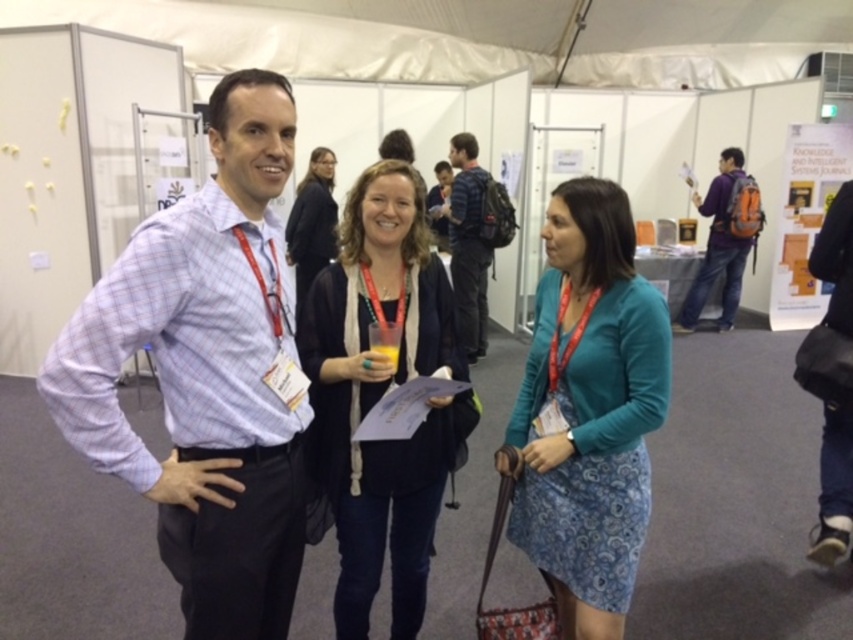
Is point (196, 483) closer to camera compared to point (810, 264)?

Yes, it is.

Can you confirm if plaid shirt at center is positioned to the left of black leather bag at lower right?

Correct, you'll find plaid shirt at center to the left of black leather bag at lower right.

The image size is (853, 640). Find the location of `plaid shirt at center`. plaid shirt at center is located at coordinates (207, 374).

Is blue plaid shirt at center closer to camera compared to matte black jacket at center?

No.

Between point (482, 168) and point (286, 236), which one is positioned behind?

Point (482, 168)

Where is `blue plaid shirt at center`? blue plaid shirt at center is located at coordinates coord(468,243).

Which is below, matte black cardigan at center or blue plaid shirt at center?

Positioned lower is matte black cardigan at center.

Does matte black cardigan at center appear over blue plaid shirt at center?

No, matte black cardigan at center is not above blue plaid shirt at center.

Locate an element on the screen. This screenshot has height=640, width=853. matte black cardigan at center is located at coordinates (381, 394).